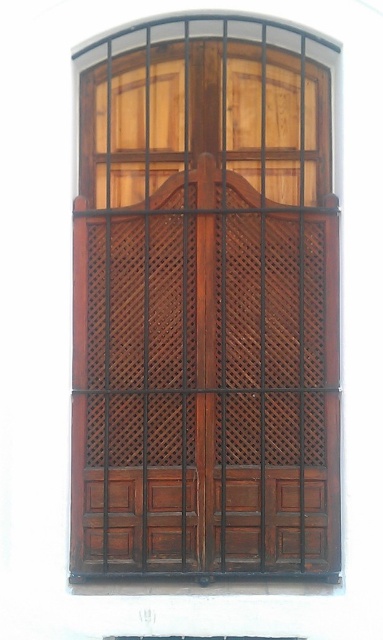
You are a painter who needs to paint two wooden objects in the scene. You have a limited amount of paint. The wooden door at center and the wooden at lower center need to be painted. Which one requires more paint due to its size?

The wooden door at center requires more paint because it is larger in size than the wooden at lower center.